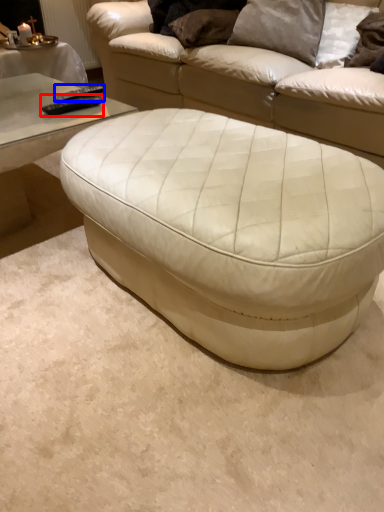
Question: Which object is further to the camera taking this photo, remote (highlighted by a red box) or remote (highlighted by a blue box)?

Choices:
 (A) remote
 (B) remote

Answer: (B)